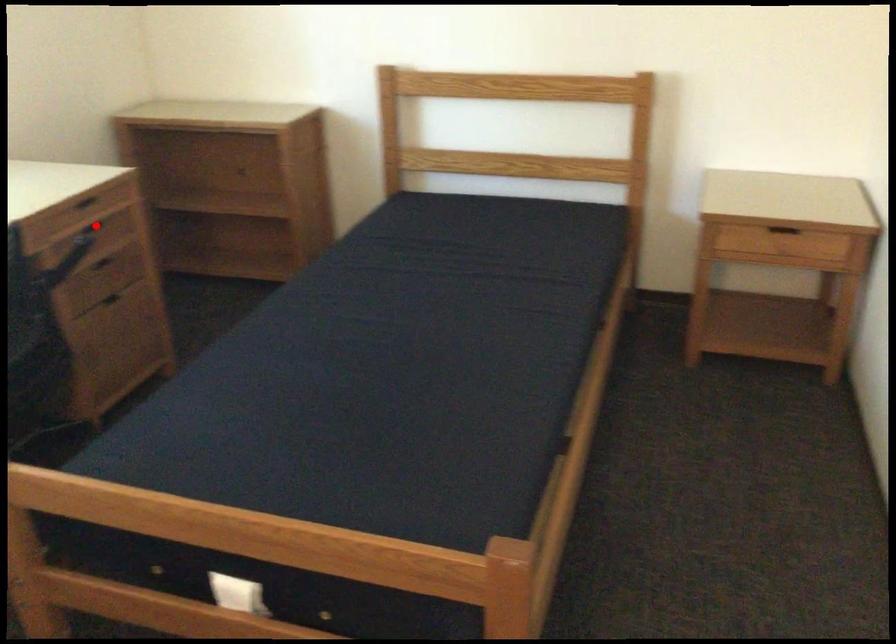
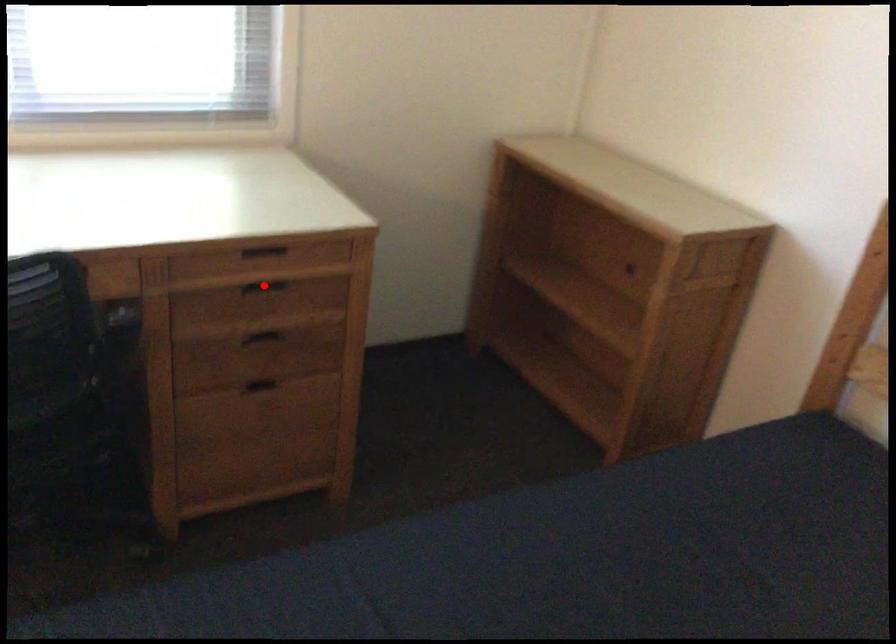
I am providing you with two images of the same scene from different viewpoints. A red point is marked on the first image and another point is marked on the second image. Do the highlighted points in image1 and image2 indicate the same real-world spot?

Yes